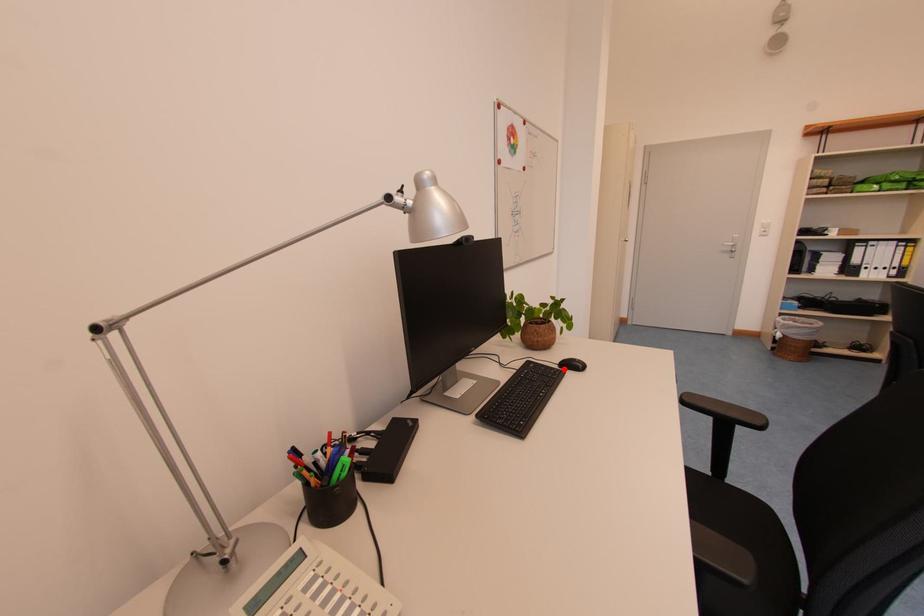
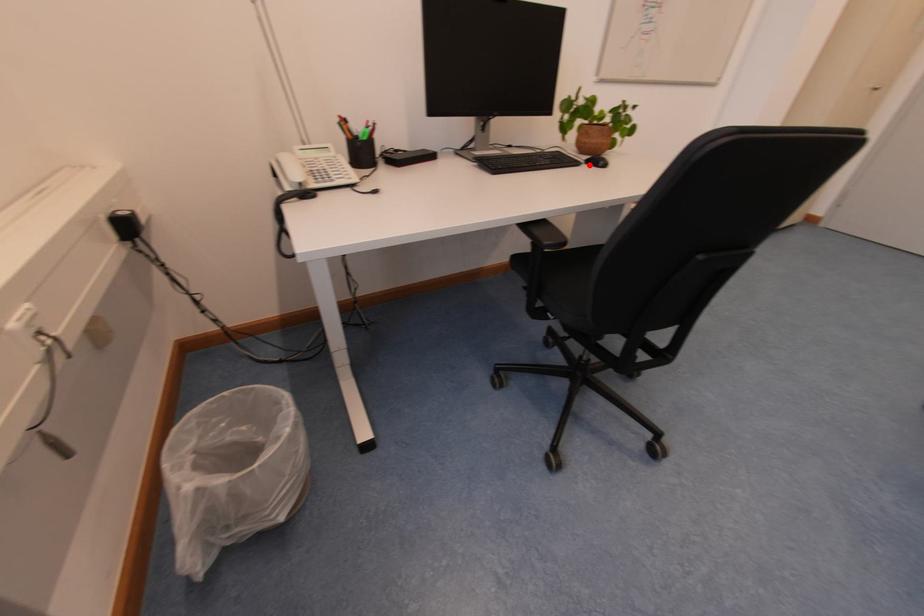
I am providing you with two images of the same scene from different viewpoints. A red point is marked on the first image and another point is marked on the second image. Is the marked point in image1 the same physical position as the marked point in image2?

Yes